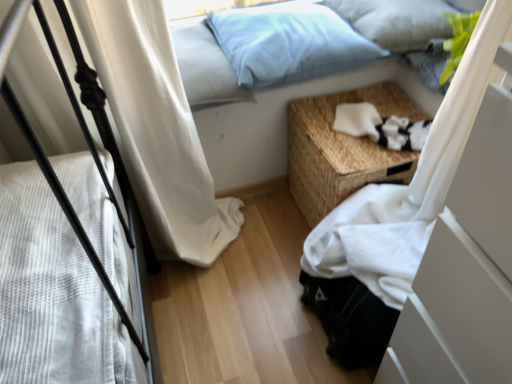
Image resolution: width=512 pixels, height=384 pixels. I want to click on vacant space situated on the left part of white fabric at lower right, so click(x=257, y=301).